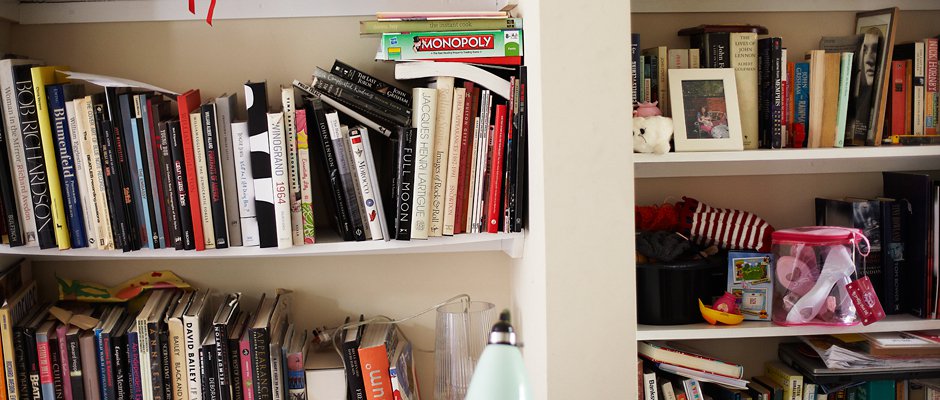
At what (x,y) coordinates should I click in order to perform the action: click on shelf. Please return your answer as a coordinate pair (x, y). This screenshot has height=400, width=940. Looking at the image, I should click on (357, 246), (728, 329), (749, 153).